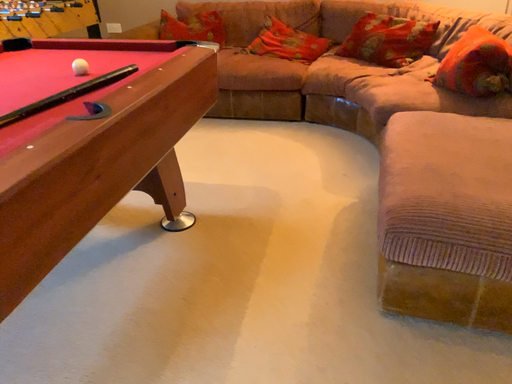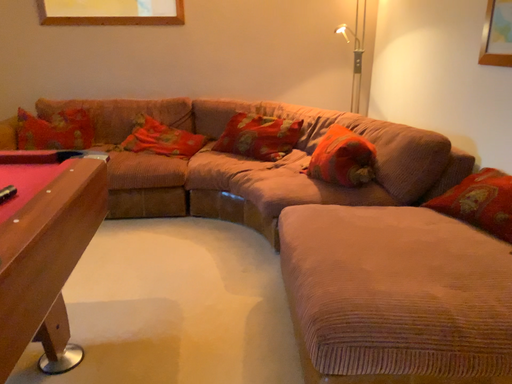
Question: Which way did the camera rotate in the video?

Choices:
 (A) rotated right
 (B) rotated left

Answer: (A)